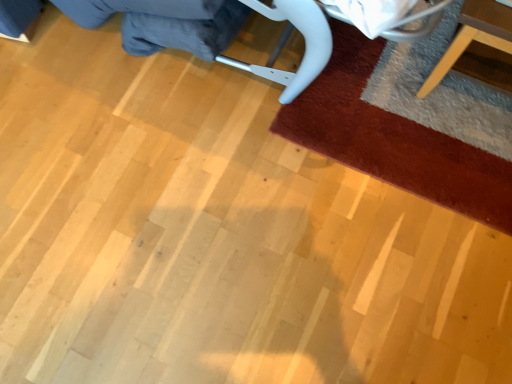
In order to face soft gray carpet at center, should I rotate leftwards or rightwards?

You should rotate right by 20.616 degrees.

The height and width of the screenshot is (384, 512). What are the coordinates of `soft gray carpet at center` in the screenshot? It's located at (397, 130).

This screenshot has width=512, height=384. What do you see at coordinates (397, 130) in the screenshot?
I see `soft gray carpet at center` at bounding box center [397, 130].

At what (x,y) coordinates should I click in order to perform the action: click on soft gray carpet at center. Please return your answer as a coordinate pair (x, y). Looking at the image, I should click on (397, 130).